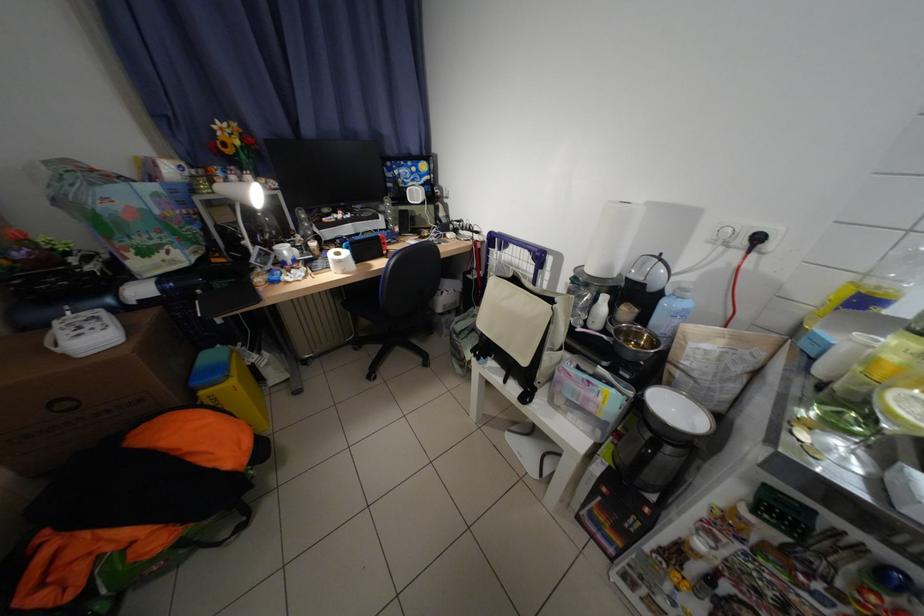
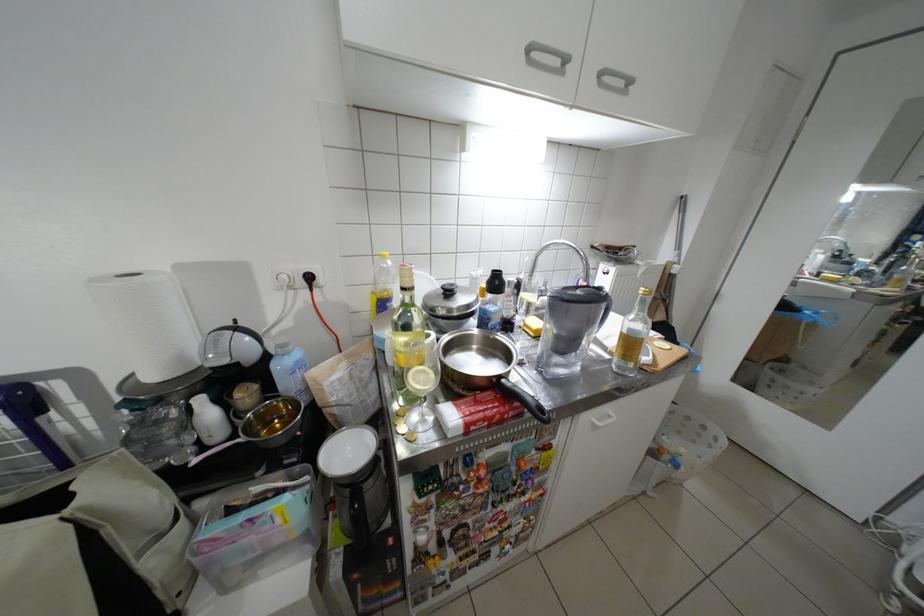
In the second image, find the point that corresponds to (x=686, y=410) in the first image.

(359, 452)